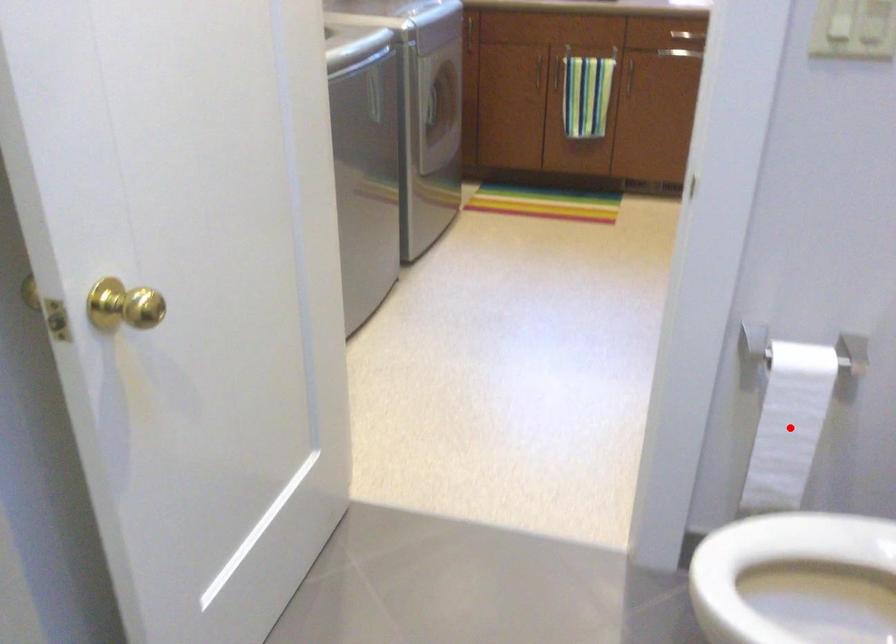
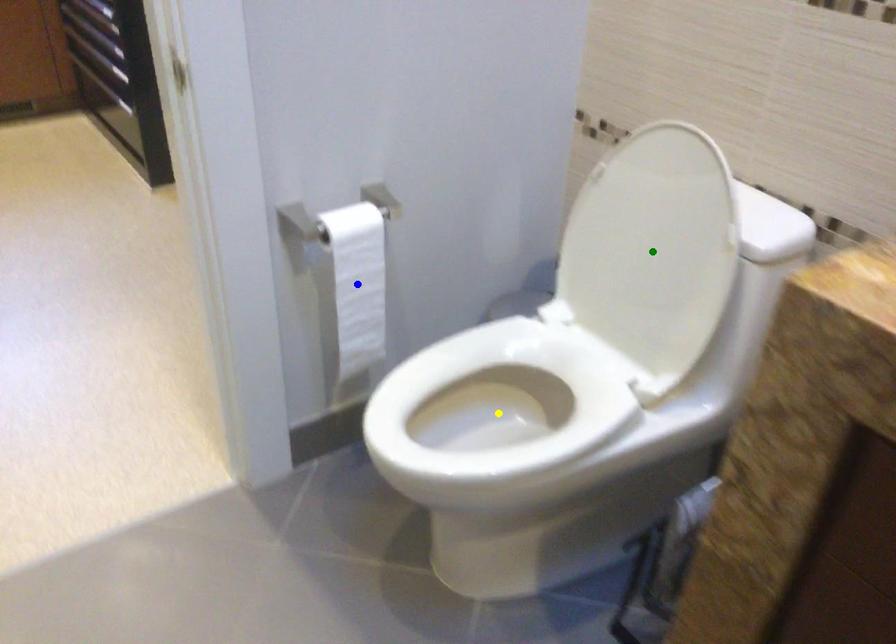
Question: I am providing you with two images of the same scene from different viewpoints. A red point is marked on the first image. You are given multiple points on the second image. Which spot in image 2 lines up with the point in image 1?

Choices:
 (A) blue point
 (B) yellow point
 (C) green point

Answer: (A)